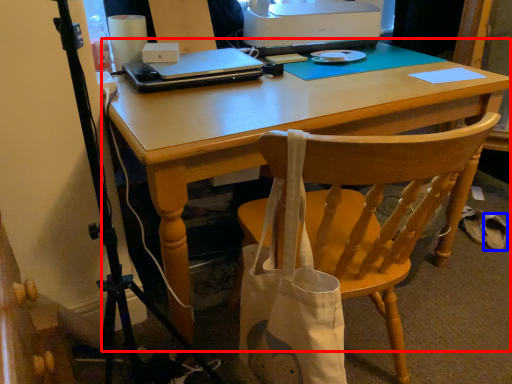
Question: Which object appears farthest to the camera in this image, computer desk (highlighted by a red box) or walking shoe (highlighted by a blue box)?

Choices:
 (A) computer desk
 (B) walking shoe

Answer: (B)